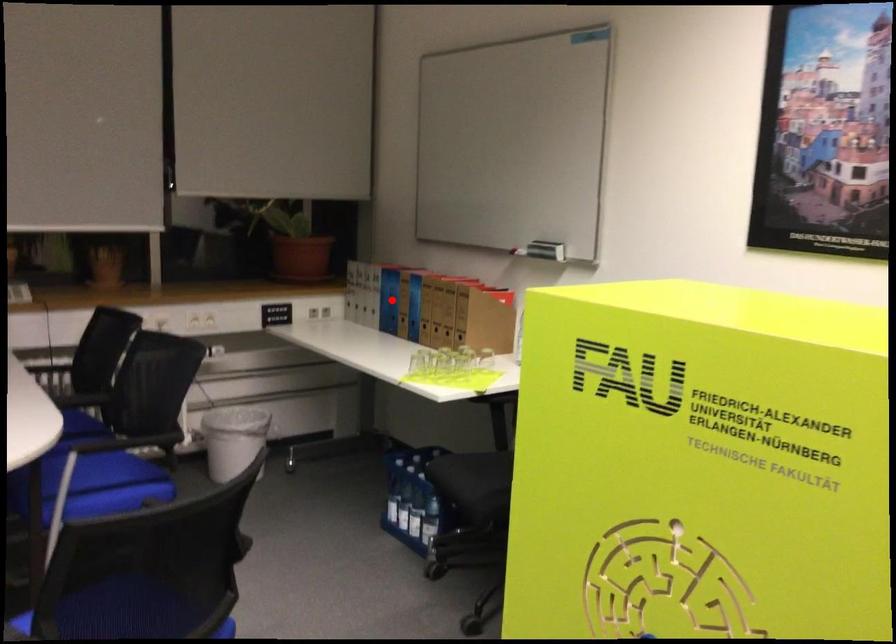
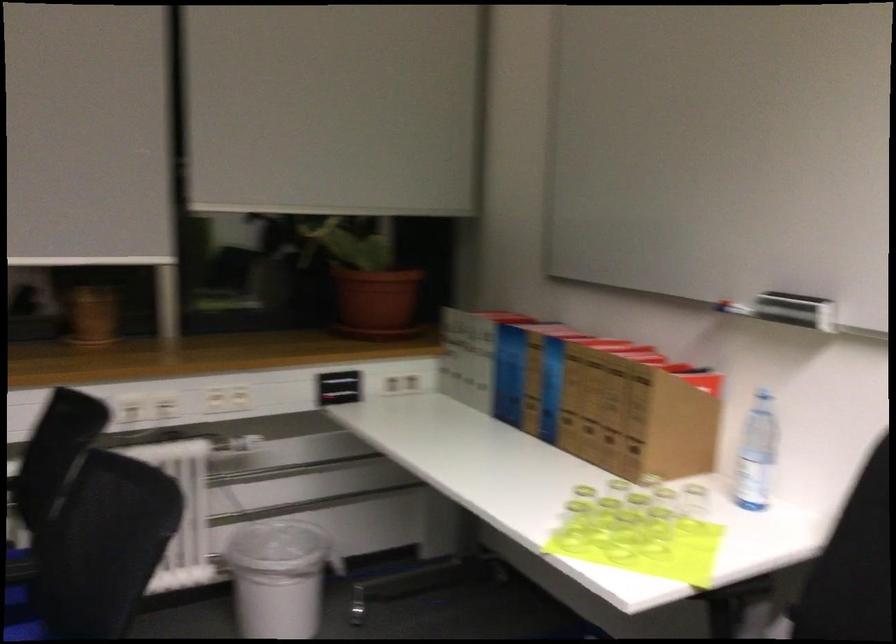
The point at the highlighted location is marked in the first image. Where is the corresponding point in the second image?

(509, 374)